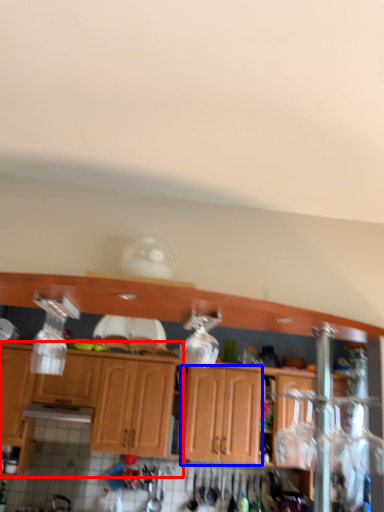
Question: Which object appears closest to the camera in this image, cabinetry (highlighted by a red box) or cabinetry (highlighted by a blue box)?

Choices:
 (A) cabinetry
 (B) cabinetry

Answer: (A)